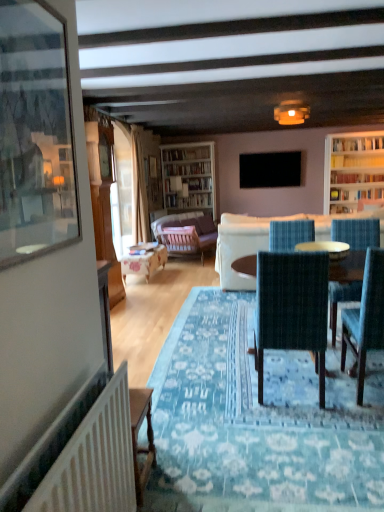
Question: From a real-world perspective, is velvet purple couch at center, arranged as the 1th studio couch when viewed from the back, beneath matte yellow lampshade at upper center?

Choices:
 (A) yes
 (B) no

Answer: (A)

Question: Is velvet purple couch at center, the second studio couch positioned from the front, located outside matte yellow lampshade at upper center?

Choices:
 (A) yes
 (B) no

Answer: (A)

Question: Is velvet purple couch at center, arranged as the 1th studio couch when viewed from the back, at the right side of matte yellow lampshade at upper center?

Choices:
 (A) no
 (B) yes

Answer: (A)

Question: Can you confirm if velvet purple couch at center, the second studio couch positioned from the front, is bigger than matte yellow lampshade at upper center?

Choices:
 (A) no
 (B) yes

Answer: (B)

Question: Is the position of velvet purple couch at center, the second studio couch positioned from the front, less distant than that of matte yellow lampshade at upper center?

Choices:
 (A) yes
 (B) no

Answer: (B)

Question: Considering the positions of white fabric couch at center, the 2th studio couch when ordered from back to front, and wooden round table at center in the image, is white fabric couch at center, the 2th studio couch when ordered from back to front, bigger or smaller than wooden round table at center?

Choices:
 (A) big
 (B) small

Answer: (A)

Question: In terms of height, does white fabric couch at center, the 2th studio couch when ordered from back to front, look taller or shorter compared to wooden round table at center?

Choices:
 (A) tall
 (B) short

Answer: (A)

Question: Is point (258, 244) closer or farther from the camera than point (342, 295)?

Choices:
 (A) farther
 (B) closer

Answer: (A)

Question: Considering the positions of white fabric couch at center, the 2th studio couch when ordered from back to front, and wooden round table at center in the image, is white fabric couch at center, the 2th studio couch when ordered from back to front, wider or thinner than wooden round table at center?

Choices:
 (A) thin
 (B) wide

Answer: (B)

Question: Is black matte television at upper center taller or shorter than wooden round table at center?

Choices:
 (A) short
 (B) tall

Answer: (A)

Question: Considering the relative positions of black matte television at upper center and wooden round table at center in the image provided, is black matte television at upper center to the left or to the right of wooden round table at center?

Choices:
 (A) right
 (B) left

Answer: (A)

Question: From the image's perspective, is black matte television at upper center located above or below wooden round table at center?

Choices:
 (A) above
 (B) below

Answer: (A)

Question: From a real-world perspective, is black matte television at upper center positioned above or below wooden round table at center?

Choices:
 (A) below
 (B) above

Answer: (B)

Question: From a real-world perspective, relative to white fabric couch at center, acting as the 1th studio couch starting from the front, is wooden desk at lower left vertically above or below?

Choices:
 (A) above
 (B) below

Answer: (B)

Question: Based on their positions, is wooden desk at lower left located to the left or right of white fabric couch at center, acting as the 1th studio couch starting from the front?

Choices:
 (A) left
 (B) right

Answer: (A)